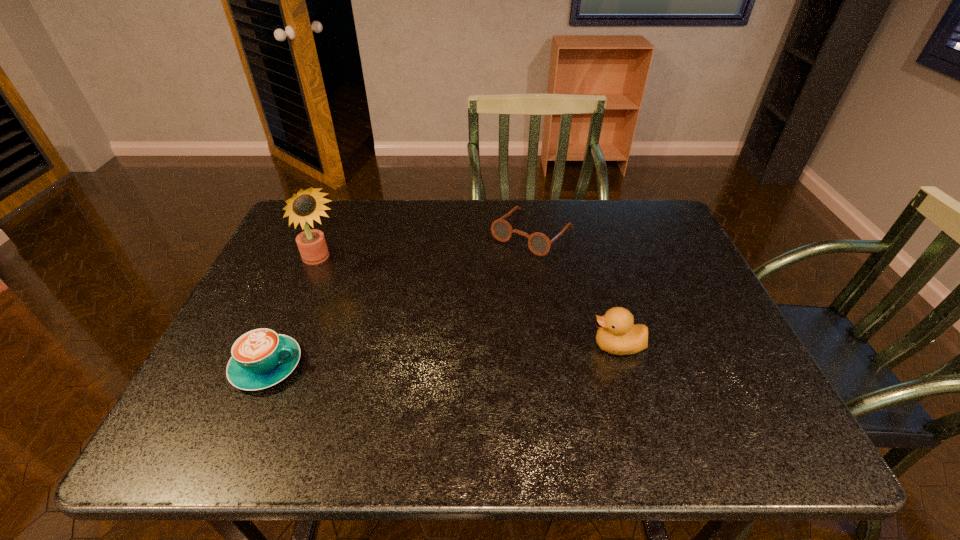
At what (x,y) coordinates should I click in order to perform the action: click on free space between the duckling and the sunflower. Please return your answer as a coordinate pair (x, y). The height and width of the screenshot is (540, 960). Looking at the image, I should click on (470, 304).

The image size is (960, 540). I want to click on free space that is in between the spectacles and the third shortest object, so click(x=575, y=289).

This screenshot has width=960, height=540. I want to click on blank region between the spectacles and the third shortest object, so click(x=575, y=289).

Find the location of a particular element. This screenshot has width=960, height=540. free space between the spectacles and the cappuccino is located at coordinates (399, 299).

What are the coordinates of `empty space between the sunflower and the cappuccino` in the screenshot? It's located at 295,314.

Identify the location of the second closest object to the duckling. Image resolution: width=960 pixels, height=540 pixels. (261, 358).

Select which object is the second closest to the duckling. Please provide its 2D coordinates. Your answer should be formatted as a tuple, i.e. [(x, y)], where the tuple contains the x and y coordinates of a point satisfying the conditions above.

[(261, 358)]

Where is `vacant area in the image that satisfies the following two spatial constraints: 1. on the front side of the spectacles; 2. facing forward on the duckling`? This screenshot has height=540, width=960. vacant area in the image that satisfies the following two spatial constraints: 1. on the front side of the spectacles; 2. facing forward on the duckling is located at coordinates (549, 346).

Identify the location of blank space that satisfies the following two spatial constraints: 1. on the front side of the sunflower; 2. facing forward on the duckling. The width and height of the screenshot is (960, 540). [x=289, y=346].